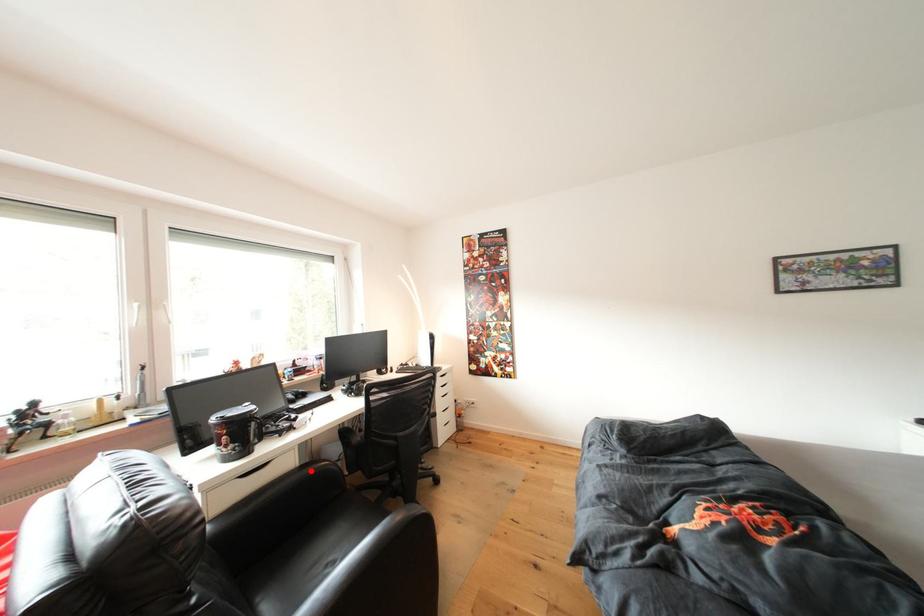
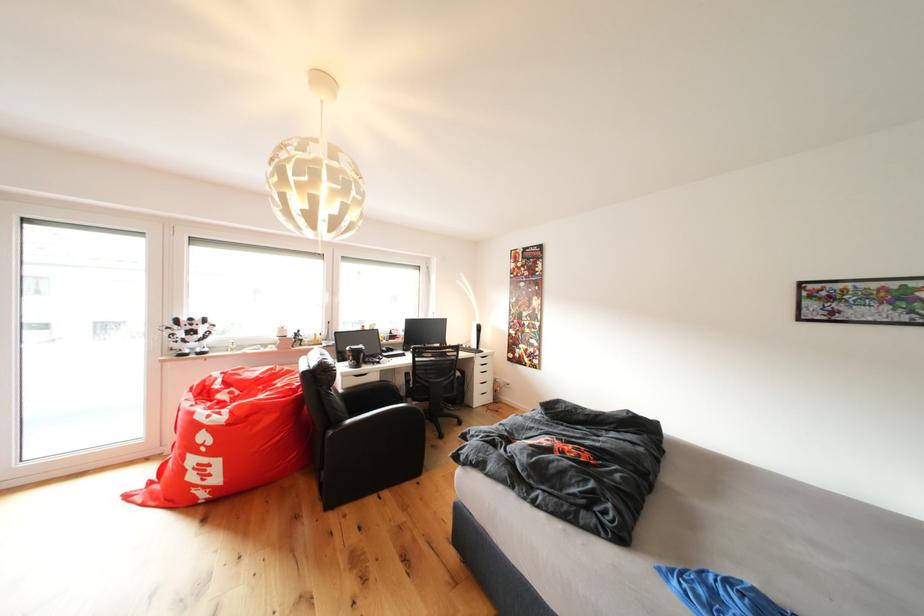
Locate, in the second image, the point that corresponds to the highlighted location in the first image.

(390, 387)